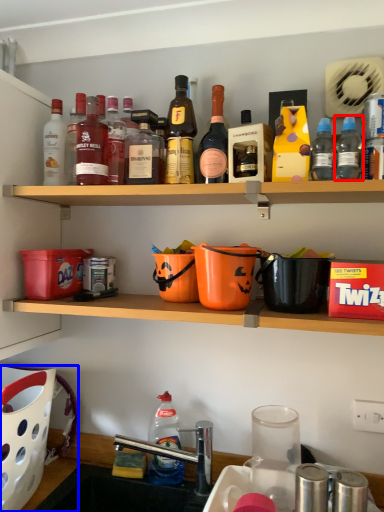
Question: Which point is closer to the camera, bottle (highlighted by a red box) or basket (highlighted by a blue box)?

Choices:
 (A) bottle
 (B) basket

Answer: (A)